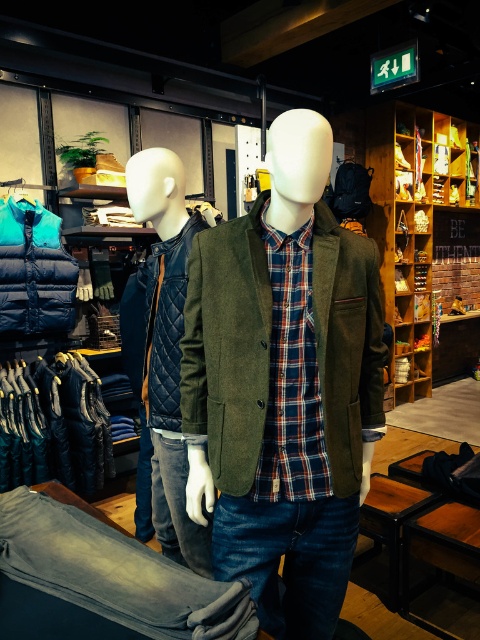
Does quilted leather jacket at left have a greater width compared to plaid cotton shirt at center?

Correct, the width of quilted leather jacket at left exceeds that of plaid cotton shirt at center.

You are a GUI agent. You are given a task and a screenshot of the screen. Output one action in this format:
    pyautogui.click(x=<x>, y=<y>)
    Task: Click on the quilted leather jacket at left
    The width and height of the screenshot is (480, 640).
    Given the screenshot: What is the action you would take?
    [167, 348]

The width and height of the screenshot is (480, 640). Find the location of `quilted leather jacket at left`. quilted leather jacket at left is located at coordinates (167, 348).

Who is more distant from viewer, (326, 148) or (310, 298)?

The point (310, 298) is more distant.

Does matte green blazer at center appear on the right side of plaid cotton shirt at center?

Indeed, matte green blazer at center is positioned on the right side of plaid cotton shirt at center.

Does point (265, 476) lie in front of point (310, 273)?

No, (265, 476) is further to viewer.

You are a GUI agent. You are given a task and a screenshot of the screen. Output one action in this format:
    pyautogui.click(x=<x>, y=<y>)
    Task: Click on the matte green blazer at center
    
    Given the screenshot: What is the action you would take?
    pyautogui.click(x=284, y=384)

Which is in front, point (165, 428) or point (24, 248)?

Point (165, 428) is in front.

Between quilted leather jacket at left and blue down vest at left, which one is positioned higher?

blue down vest at left is higher up.

Does point (163, 234) come behind point (52, 241)?

No, (163, 234) is in front of (52, 241).

The image size is (480, 640). I want to click on quilted leather jacket at left, so click(167, 348).